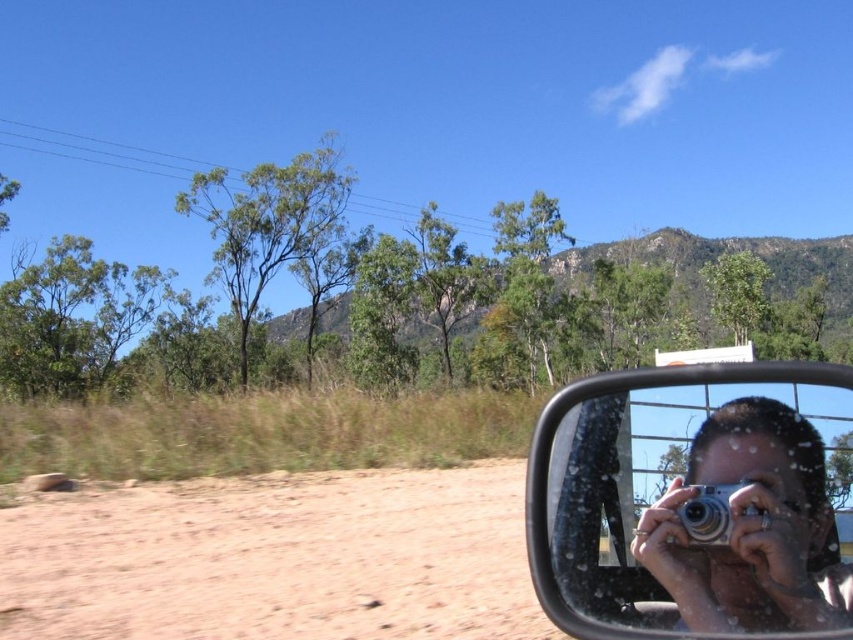
Is brown sandy dirt track at lower left taller than silver metallic mirror at right?

Incorrect, brown sandy dirt track at lower left's height is not larger of silver metallic mirror at right's.

The image size is (853, 640). What are the coordinates of `brown sandy dirt track at lower left` in the screenshot? It's located at (276, 560).

Is silver metallic mirror at right thinner than silver metallic camera at right?

Incorrect, silver metallic mirror at right's width is not less than silver metallic camera at right's.

Is point (682, 595) more distant than point (718, 544)?

Yes.

Is point (822, 586) farther from viewer compared to point (688, 534)?

No, it is not.

Where is `silver metallic mirror at right`? This screenshot has width=853, height=640. silver metallic mirror at right is located at coordinates (695, 502).

Does brown sandy dirt track at lower left appear on the right side of silver metallic camera at right?

Incorrect, brown sandy dirt track at lower left is not on the right side of silver metallic camera at right.

Is brown sandy dirt track at lower left taller than silver metallic camera at right?

No, brown sandy dirt track at lower left is not taller than silver metallic camera at right.

Which is in front, point (218, 554) or point (704, 536)?

Positioned in front is point (704, 536).

The width and height of the screenshot is (853, 640). What are the coordinates of `brown sandy dirt track at lower left` in the screenshot? It's located at (276, 560).